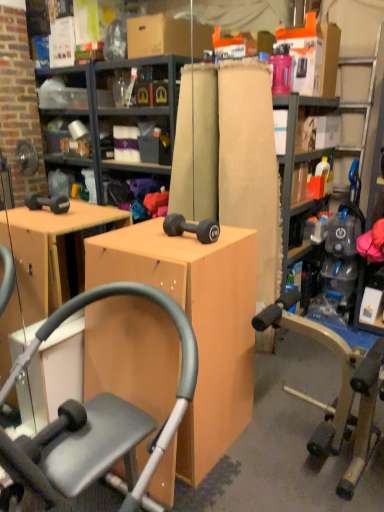
Question: Are wooden bookshelf at center and matte wood desk at center located far from each other?

Choices:
 (A) yes
 (B) no

Answer: (A)

Question: Is wooden bookshelf at center thinner than matte wood desk at center?

Choices:
 (A) no
 (B) yes

Answer: (B)

Question: From the image's perspective, is wooden bookshelf at center below matte wood desk at center?

Choices:
 (A) yes
 (B) no

Answer: (B)

Question: Is wooden bookshelf at center touching matte wood desk at center?

Choices:
 (A) yes
 (B) no

Answer: (B)

Question: From a real-world perspective, is wooden bookshelf at center located beneath matte wood desk at center?

Choices:
 (A) no
 (B) yes

Answer: (A)

Question: Considering the positions of matte wood desk at center and matte black dumbbell at center in the image, is matte wood desk at center wider or thinner than matte black dumbbell at center?

Choices:
 (A) thin
 (B) wide

Answer: (B)

Question: Considering the positions of point (193, 437) and point (205, 232), is point (193, 437) closer or farther from the camera than point (205, 232)?

Choices:
 (A) closer
 (B) farther

Answer: (A)

Question: Visually, is matte wood desk at center positioned to the left or to the right of matte black dumbbell at center?

Choices:
 (A) right
 (B) left

Answer: (B)

Question: Considering the positions of matte wood desk at center and matte black dumbbell at center in the image, is matte wood desk at center bigger or smaller than matte black dumbbell at center?

Choices:
 (A) big
 (B) small

Answer: (A)

Question: Which is correct: matte black exercise machine at center is inside wooden bookshelf at center, or outside of it?

Choices:
 (A) inside
 (B) outside

Answer: (B)

Question: From a real-world perspective, is matte black exercise machine at center positioned above or below wooden bookshelf at center?

Choices:
 (A) below
 (B) above

Answer: (A)

Question: From the image's perspective, is matte black exercise machine at center located above or below wooden bookshelf at center?

Choices:
 (A) above
 (B) below

Answer: (B)

Question: Considering the positions of matte black exercise machine at center and wooden bookshelf at center in the image, is matte black exercise machine at center wider or thinner than wooden bookshelf at center?

Choices:
 (A) thin
 (B) wide

Answer: (B)

Question: Considering the positions of point (112, 390) and point (312, 148), is point (112, 390) closer or farther from the camera than point (312, 148)?

Choices:
 (A) closer
 (B) farther

Answer: (A)

Question: Visually, is matte wood desk at center positioned to the left or to the right of matte cardboard shelf at upper center?

Choices:
 (A) left
 (B) right

Answer: (A)